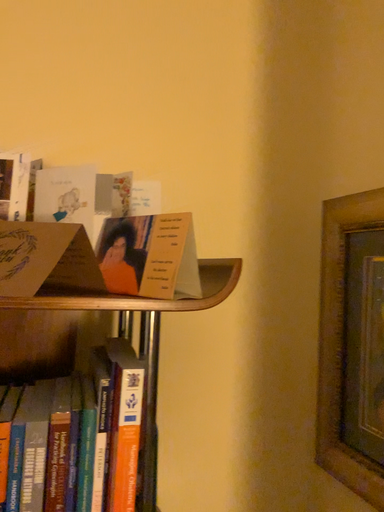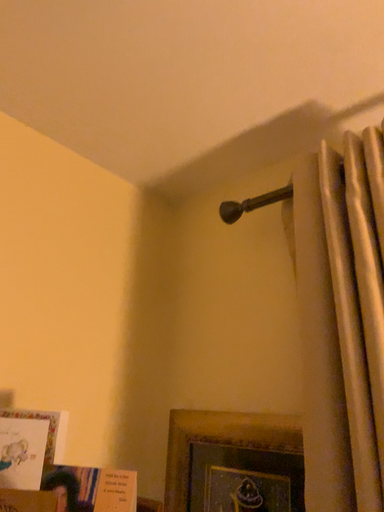
Question: Which way did the camera rotate in the video?

Choices:
 (A) rotated upward
 (B) rotated downward

Answer: (A)